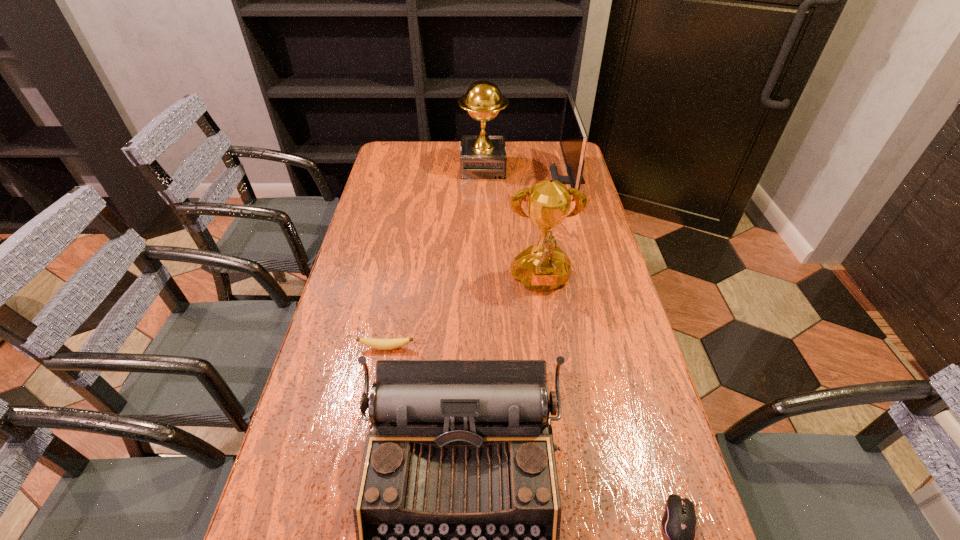
In the image, there is a desktop. At what (x,y) coordinates should I click in order to perform the action: click on vacant region at the right edge. Please return your answer as a coordinate pair (x, y). Image resolution: width=960 pixels, height=540 pixels. Looking at the image, I should click on (588, 268).

At what (x,y) coordinates should I click in order to perform the action: click on free space at the far left corner. Please return your answer as a coordinate pair (x, y). This screenshot has width=960, height=540. Looking at the image, I should click on (384, 168).

Locate an element on the screen. The height and width of the screenshot is (540, 960). blank region between the farther award and the third farthest object is located at coordinates (512, 225).

The height and width of the screenshot is (540, 960). Find the location of `free space between the farther award and the third tallest object`. free space between the farther award and the third tallest object is located at coordinates (526, 174).

Select which object is the second closest to the typewriter. Please provide its 2D coordinates. Your answer should be formatted as a tuple, i.e. [(x, y)], where the tuple contains the x and y coordinates of a point satisfying the conditions above.

[(679, 521)]

Image resolution: width=960 pixels, height=540 pixels. I want to click on object that stands as the second closest to the nearer award, so click(x=381, y=344).

Identify the location of vacant space that satisfies the following two spatial constraints: 1. on the screen side of the third tallest object; 2. on the front side of the nearer award. The height and width of the screenshot is (540, 960). (595, 282).